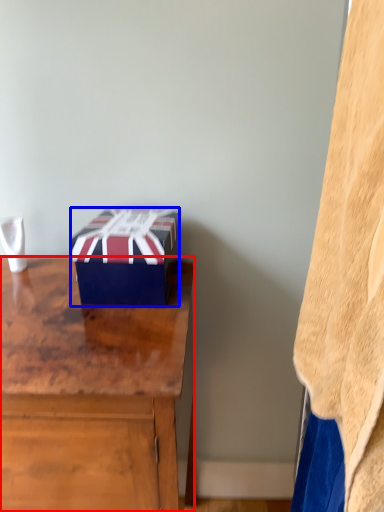
Question: Which of the following is the closest to the observer, desk (highlighted by a red box) or box (highlighted by a blue box)?

Choices:
 (A) desk
 (B) box

Answer: (A)